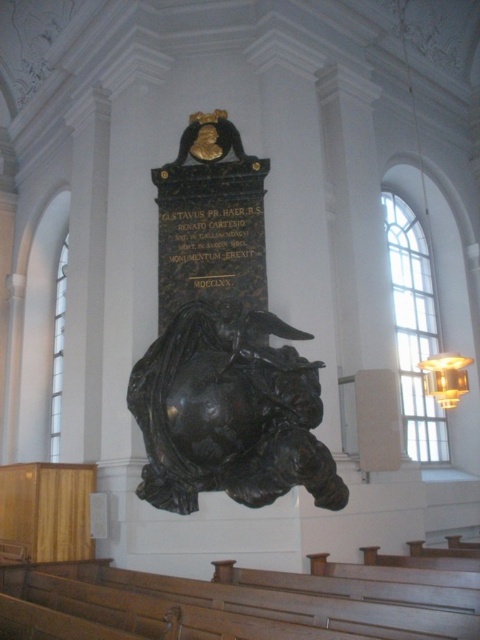
Who is lower down, black polished stone sculpture at center or black stone plaque at center?

black polished stone sculpture at center is below.

Does black polished stone sculpture at center appear under black stone plaque at center?

Indeed, black polished stone sculpture at center is positioned under black stone plaque at center.

Between point (324, 452) and point (220, 230), which one is positioned behind?

Positioned behind is point (220, 230).

In order to click on black polished stone sculpture at center in this screenshot , I will do `click(229, 413)`.